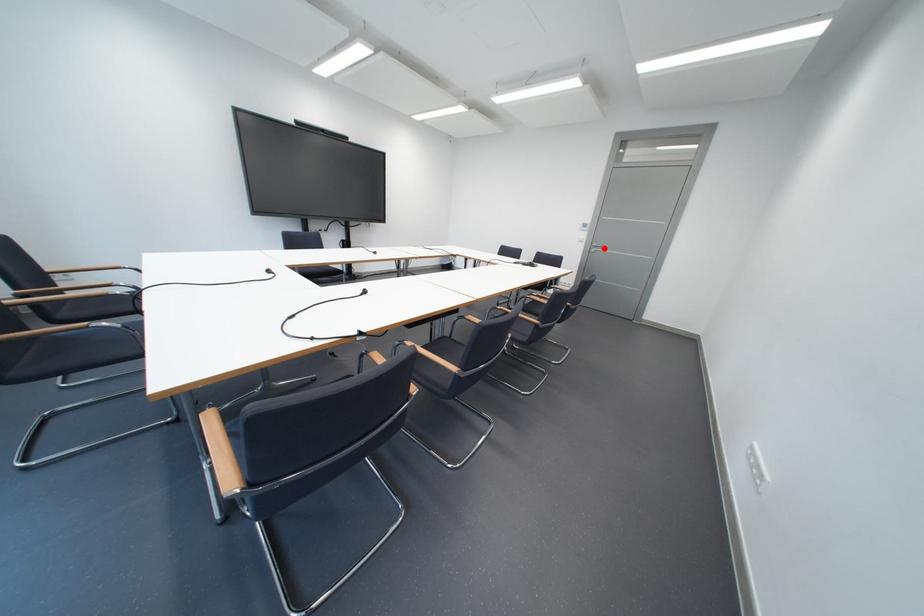
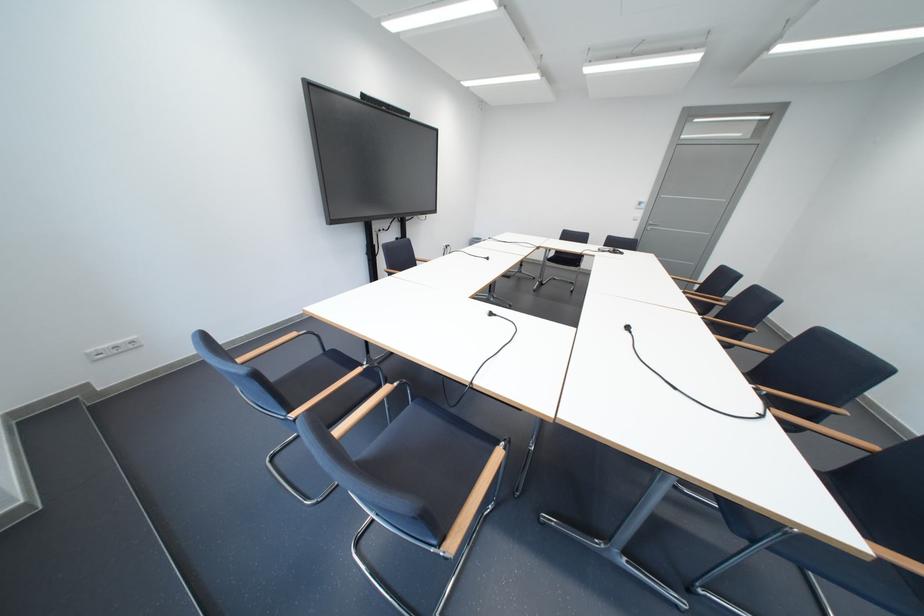
Question: A red point is marked in image1. In image2, is the corresponding 3D point closer to the camera or farther? Reply with the corresponding letter.

Choices:
 (A) The corresponding 3D point is closer.
 (B) The corresponding 3D point is farther.

Answer: (B)